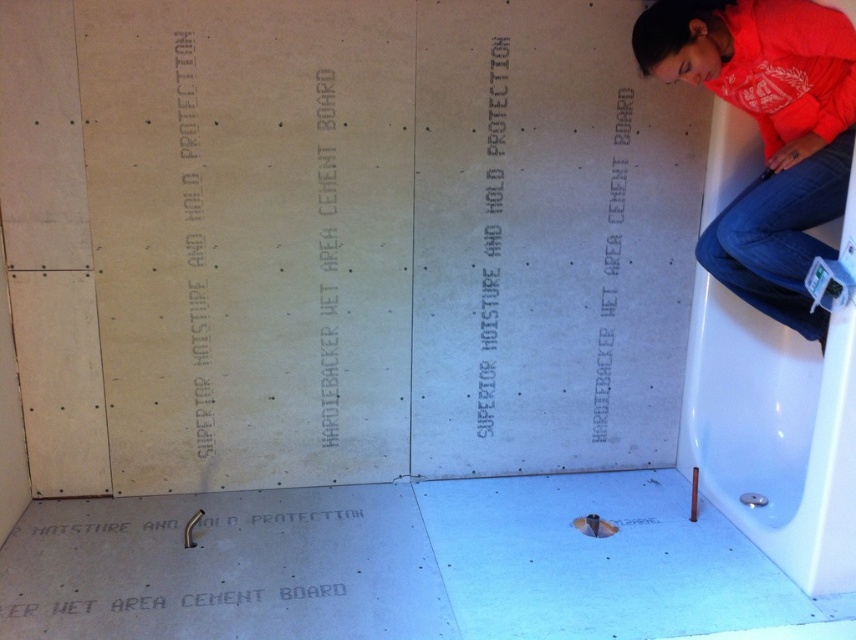
You are an inspector checking the bathroom renovation. You notice the orange cotton shirt at upper right and the white matte writing at upper left. Which object is nearer to you?

The orange cotton shirt at upper right is closer to the viewer than the white matte writing at upper left.

You are a construction worker who needs to take a photo of the orange cotton shirt at upper right. You have a camera that requires you to be at least 5 feet away to focus properly. Can you take a clear photo with your current position?

The orange cotton shirt at upper right and camera are 6.82 feet apart, so yes, you can take a clear photo since the distance is more than the required 5 feet.

You are an interior designer inspecting the bathroom renovation. You notice the orange cotton shirt at upper right and the white matte writing at upper left. Which object occupies more space in the image?

The orange cotton shirt at upper right has a larger size compared to the white matte writing at upper left, so it occupies more space in the image.